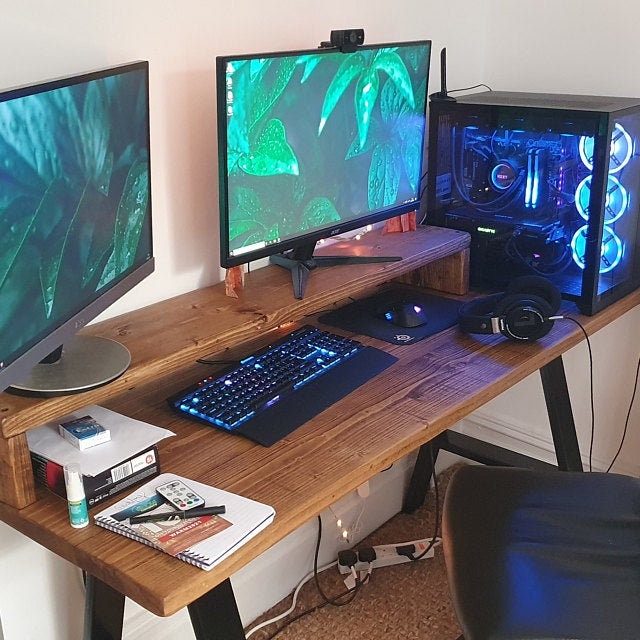
Identify the location of chair. Image resolution: width=640 pixels, height=640 pixels. tap(587, 556).